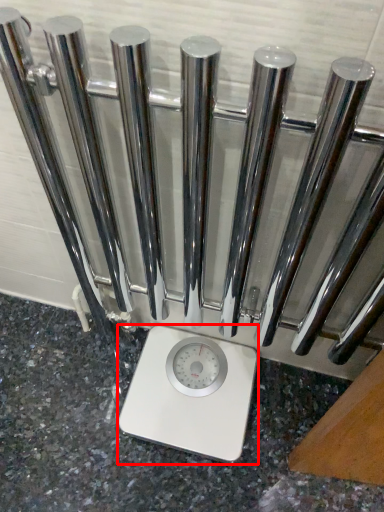
Question: From the image's perspective, what is the correct spatial relationship of scale (annotated by the red box) in relation to granite?

Choices:
 (A) below
 (B) above

Answer: (B)